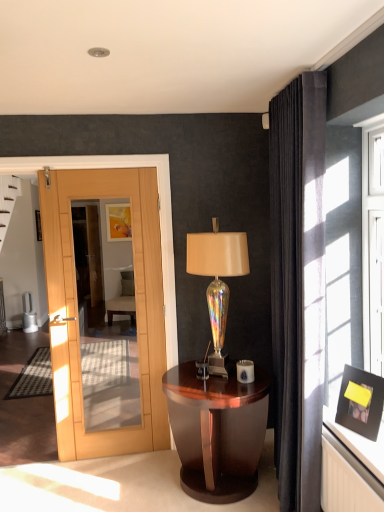
Question: Looking at the image, does matte black picture frame at upper right, the second picture frame when ordered from left to right, seem bigger or smaller compared to velvet dark gray curtain at right?

Choices:
 (A) big
 (B) small

Answer: (B)

Question: Is point (360, 381) closer or farther from the camera than point (278, 386)?

Choices:
 (A) farther
 (B) closer

Answer: (B)

Question: Considering the real-world distances, which object is closest to the iridescent glass table lamp at center?

Choices:
 (A) glossy wood nightstand at center
 (B) matte gold picture frame at upper center, the first picture frame when ordered from top to bottom
 (C) velvet dark gray curtain at right
 (D) matte black picture frame at upper right, the second picture frame from the top

Answer: (C)

Question: Which of these objects is positioned closest to the velvet dark gray curtain at right?

Choices:
 (A) matte gold picture frame at upper center, the 2th picture frame viewed from the right
 (B) matte black picture frame at upper right, which is the 2th picture frame from back to front
 (C) iridescent glass table lamp at center
 (D) glossy wood nightstand at center

Answer: (B)